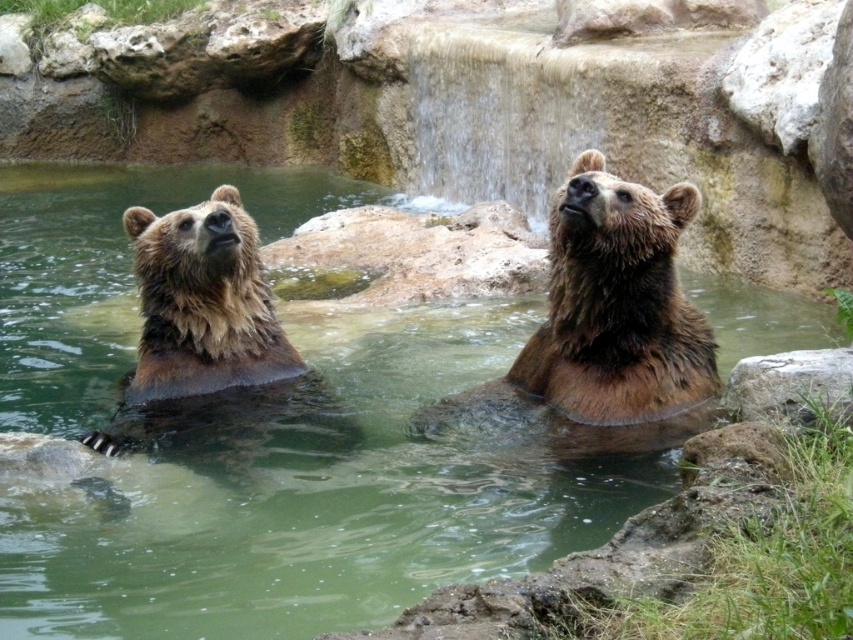
Does point (329, 324) lie in front of point (643, 352)?

No, it is not.

Is green liquid water at center above brown furry bear at center?

Yes, green liquid water at center is above brown furry bear at center.

Between point (105, 308) and point (601, 324), which one is positioned behind?

The point (105, 308) is behind.

The height and width of the screenshot is (640, 853). Find the location of `green liquid water at center`. green liquid water at center is located at coordinates (321, 500).

Is point (494, 561) positioned before point (277, 397)?

Yes, it is in front of point (277, 397).

Which is in front, point (428, 488) or point (177, 390)?

Point (428, 488) is more forward.

Image resolution: width=853 pixels, height=640 pixels. I want to click on green liquid water at center, so click(x=321, y=500).

Between point (618, 417) and point (317, 396), which one is positioned behind?

Point (317, 396)

Is brown furry bear at center positioned before brown furry bear at left?

Yes, brown furry bear at center is closer to the viewer.

Is point (561, 204) in front of point (263, 332)?

Yes, point (561, 204) is in front of point (263, 332).

You are a GUI agent. You are given a task and a screenshot of the screen. Output one action in this format:
    pyautogui.click(x=<x>, y=<y>)
    Task: Click on the brown furry bear at center
    Image resolution: width=853 pixels, height=640 pixels.
    Given the screenshot: What is the action you would take?
    pyautogui.click(x=604, y=330)